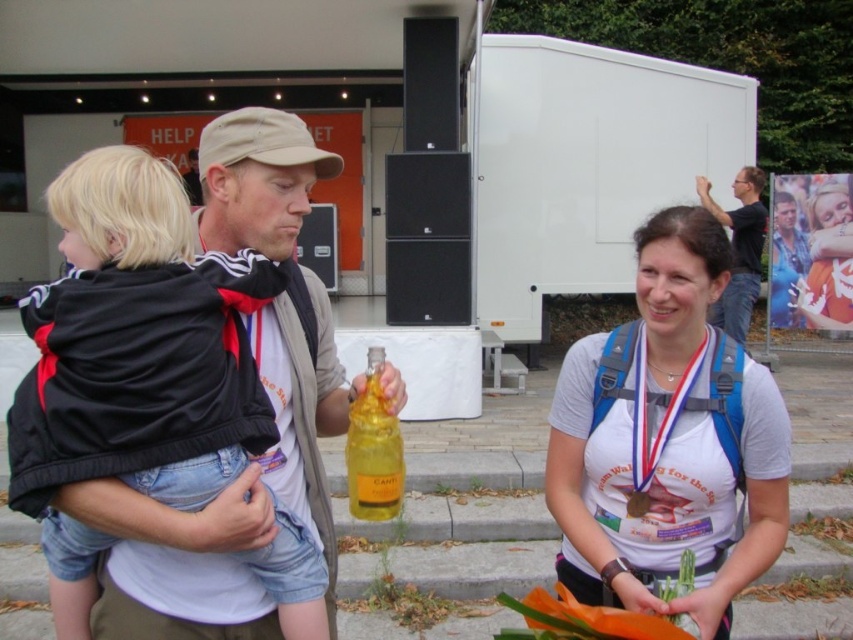
You are standing at the point labeled point (56,204) and want to walk towards the point labeled point (817,316). Which direction should you move?

Since point (56,204) is in front of point (817,316), you should move backward to reach point (817,316) from your current position.